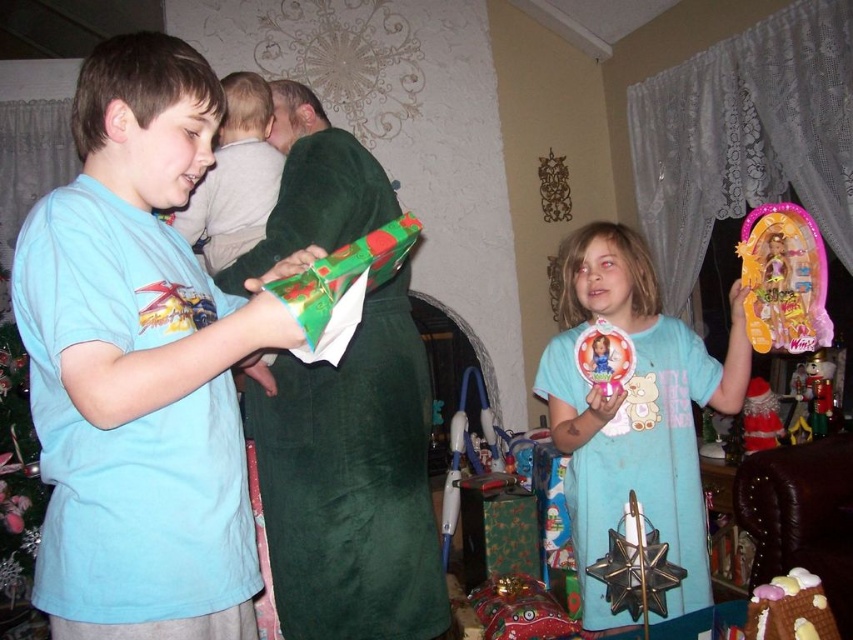
Between matte green blanket at upper center and chocolate cake at lower right, which one has more height?

With more height is matte green blanket at upper center.

From the picture: Is matte green blanket at upper center bigger than chocolate cake at lower right?

Indeed, matte green blanket at upper center has a larger size compared to chocolate cake at lower right.

The height and width of the screenshot is (640, 853). What are the coordinates of `matte green blanket at upper center` in the screenshot? It's located at (235, 177).

Which is more to the left, matte blue shirt at left or green shiny wrapping paper at center?

matte blue shirt at left

Does point (51, 440) come in front of point (271, 284)?

No, it is behind (271, 284).

The image size is (853, 640). What do you see at coordinates (140, 364) in the screenshot?
I see `matte blue shirt at left` at bounding box center [140, 364].

Where is `matte blue shirt at left`? Image resolution: width=853 pixels, height=640 pixels. matte blue shirt at left is located at coordinates (140, 364).

Can you confirm if green shiny wrapping paper at center is smaller than satin red santa hat at upper right?

Actually, green shiny wrapping paper at center might be larger than satin red santa hat at upper right.

Is green shiny wrapping paper at center further to the viewer compared to satin red santa hat at upper right?

No, green shiny wrapping paper at center is in front of satin red santa hat at upper right.

Is point (292, 300) farther from viewer compared to point (757, 404)?

That is False.

The image size is (853, 640). Find the location of `green shiny wrapping paper at center`. green shiny wrapping paper at center is located at coordinates (341, 288).